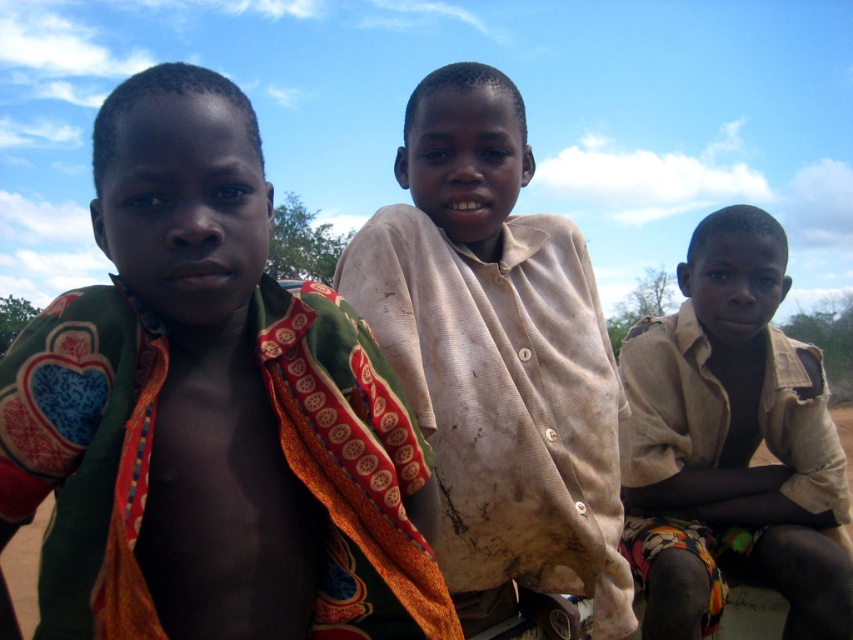
In the scene shown: Measure the distance from multicolored fabric at left to brown dirt field at lower center.

The distance of multicolored fabric at left from brown dirt field at lower center is 8.73 feet.

Looking at this image, can you confirm if multicolored fabric at left is smaller than brown dirt field at lower center?

Yes.

Does point (142, 500) come closer to viewer compared to point (25, 545)?

Yes, point (142, 500) is in front of point (25, 545).

Locate an element on the screen. Image resolution: width=853 pixels, height=640 pixels. multicolored fabric at left is located at coordinates (210, 410).

Can you confirm if multicolored fabric at left is taller than light brown cotton shirt at center?

Incorrect, multicolored fabric at left's height is not larger of light brown cotton shirt at center's.

Between multicolored fabric at left and light brown cotton shirt at center, which one is positioned higher?

multicolored fabric at left

Is point (149, 68) farther from camera compared to point (755, 300)?

Yes, point (149, 68) is farther from viewer.

The width and height of the screenshot is (853, 640). What are the coordinates of `multicolored fabric at left` in the screenshot? It's located at (210, 410).

The height and width of the screenshot is (640, 853). Identify the location of light brown cotton shirt at center. (730, 445).

Between light brown cotton shirt at center and brown dirt field at lower center, which one has less height?

With less height is light brown cotton shirt at center.

Describe the element at coordinates (730, 445) in the screenshot. I see `light brown cotton shirt at center` at that location.

In order to click on light brown cotton shirt at center in this screenshot , I will do `click(730, 445)`.